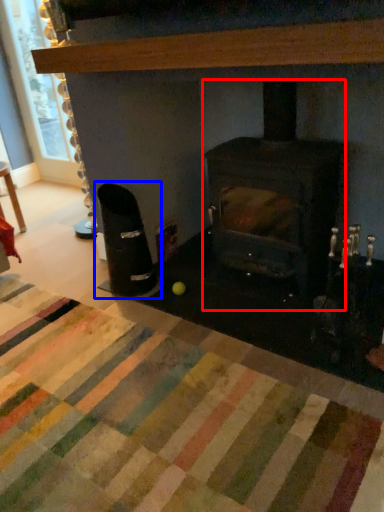
Question: Which object appears farthest to the camera in this image, wood burning stove (highlighted by a red box) or armchair (highlighted by a blue box)?

Choices:
 (A) wood burning stove
 (B) armchair

Answer: (B)